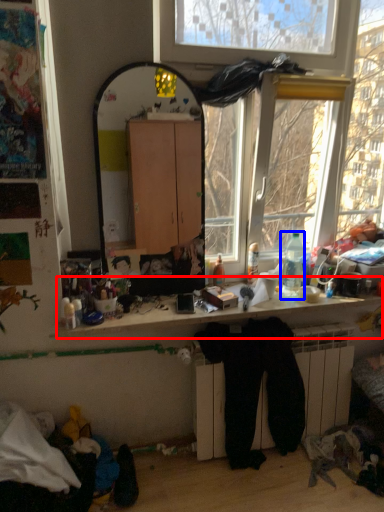
Question: Which object appears closest to the camera in this image, computer desk (highlighted by a red box) or bottle (highlighted by a blue box)?

Choices:
 (A) computer desk
 (B) bottle

Answer: (A)